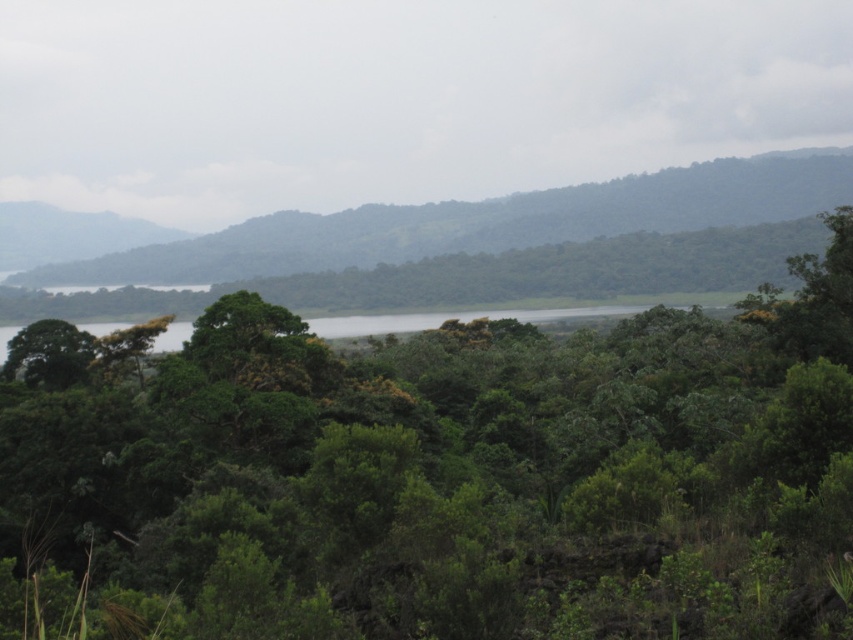
You are standing in the lush landscape and want to take a photo of both the green leafy tree at center and the green leafy hillside at center. Which one should you focus on first to ensure both are in clear view?

Since the green leafy tree at center is closer to the viewer than the green leafy hillside at center, you should focus on the green leafy tree at center first to ensure both are in clear view.

You are standing at the center of the image and want to locate the green leafy hillside at center. What are the coordinates of its position?

The green leafy hillside at center is located at coordinates point (480, 224).

You are standing in the lush landscape and see the green leafy tree at center and the green leafy hillside at center. Which one is closer to the ground?

The green leafy tree at center is closer to the ground because it is positioned below the green leafy hillside at center.